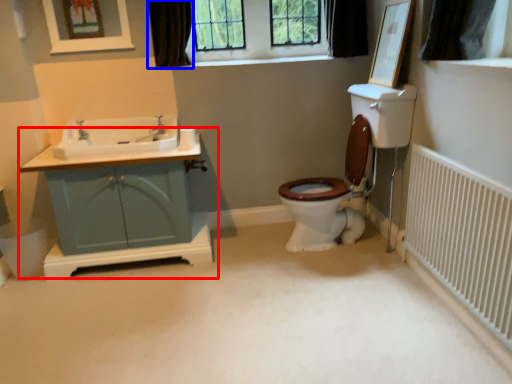
Question: Which of the following is the farthest to the observer, bathroom cabinet (highlighted by a red box) or curtain (highlighted by a blue box)?

Choices:
 (A) bathroom cabinet
 (B) curtain

Answer: (B)